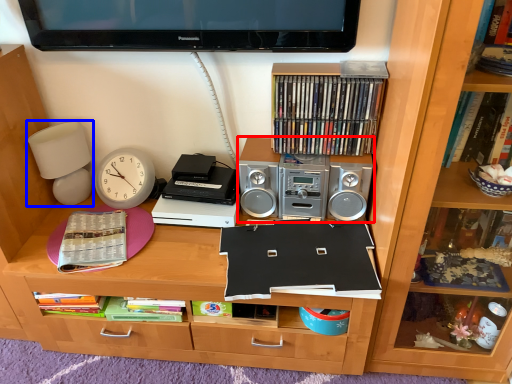
Question: Which object is further to the camera taking this photo, stereo (highlighted by a red box) or table lamp (highlighted by a blue box)?

Choices:
 (A) stereo
 (B) table lamp

Answer: (B)